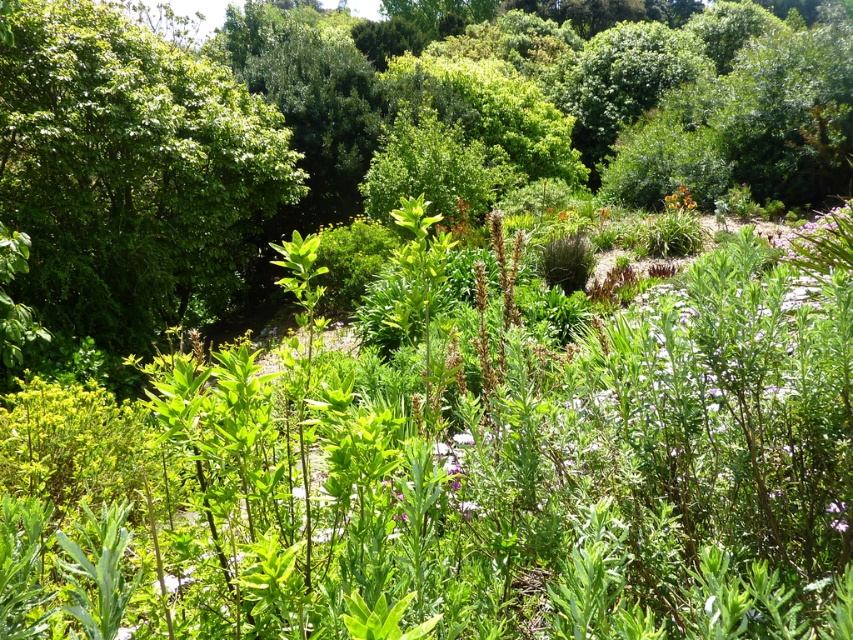
You are a gardener planning to plant a new tree in your garden. You have a space that can accommodate a plant up to the size of the orange matte flower at upper right. Based on the garden scene provided, will the green leafy tree at upper left fit in that space?

The green leafy tree at upper left is wider than the orange matte flower at upper right, so it will not fit in the space designated for the smaller plant.

You are standing in the garden and want to take a photo of both the green leafy tree at upper left and the orange matte flower at upper right. Which direction should you move to ensure both are in your camera frame?

You should move to the right to ensure both the green leafy tree at upper left and the orange matte flower at upper right are in your camera frame because the green leafy tree at upper left is to the left of the orange matte flower at upper right.

You are standing in the garden and want to take a photo of the green leafy tree at center. If your camera has a maximum focusing distance of 7 meters, will it be able to focus on the tree?

The green leafy tree at center is 7.36 meters away from the viewer. Since the camera can only focus up to 7 meters, it will not be able to focus on the tree.